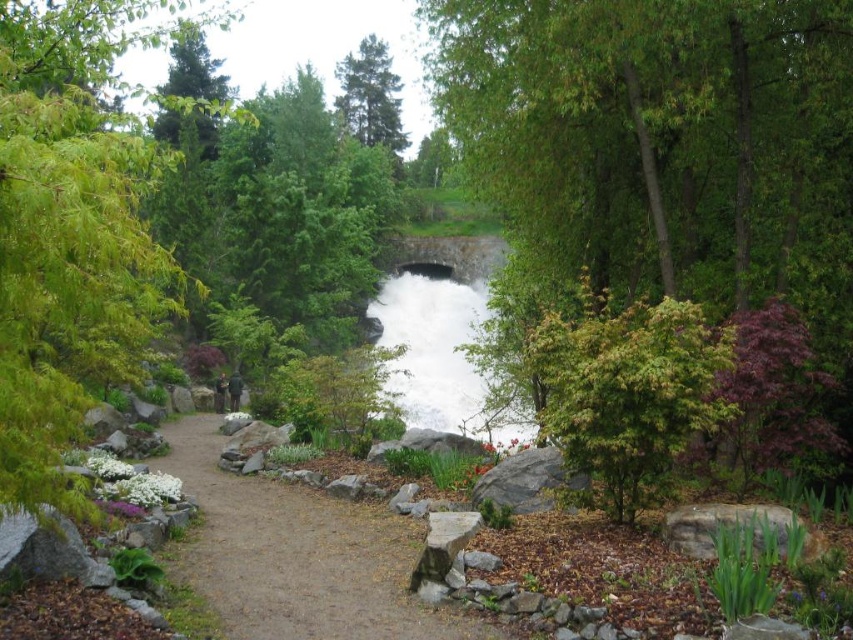
From the picture: You are standing on the paved pathway and want to take a photo of both the green leafy tree at left and the green matte tree at upper left. Which tree should you position yourself closer to in order to capture both in the same frame?

You should position yourself closer to the green leafy tree at left because it is nearer to you than the green matte tree at upper left, allowing both to be included in the frame without cropping either out.

You are a gardener planning to plant flowers along the brown dirt path at center and the green matte tree at upper left. Which area requires more space for planting due to the size difference?

The green matte tree at upper left requires more space for planting because it is larger than the brown dirt path at center.